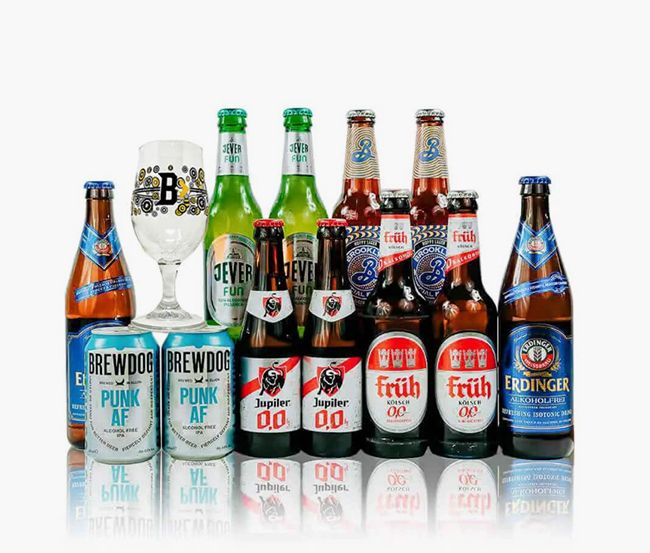
Where is `bottle of beer`? This screenshot has height=553, width=650. bottle of beer is located at coordinates (93, 281), (233, 227), (292, 195), (272, 268), (327, 294), (398, 311), (465, 316), (522, 317), (430, 173), (359, 185).